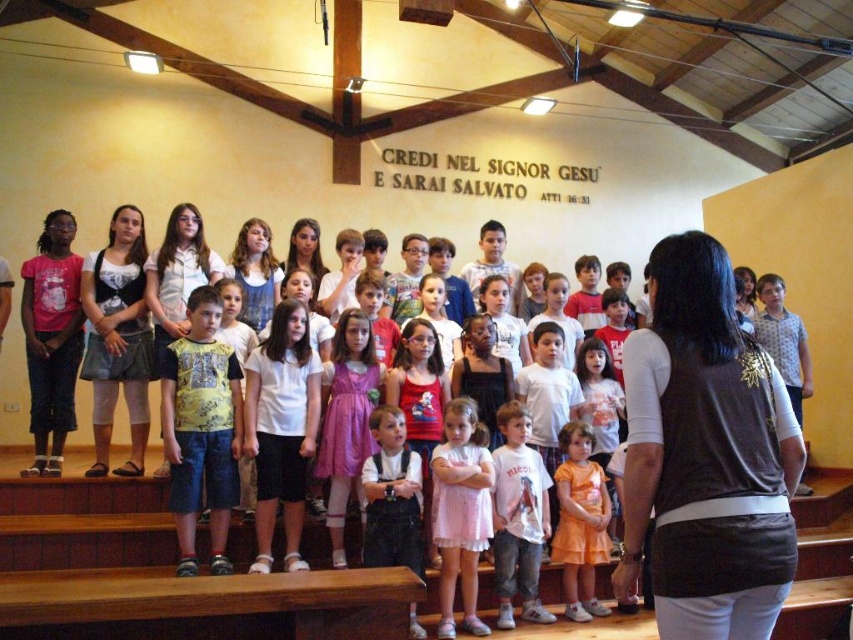
You are a photographer setting up for a school choir performance. You need to ensure that the pink cotton dress at center and the orange satin dress at center are visible in the photo. Which dress should you focus on to capture more detail due to its size?

The orange satin dress at center is thicker than the pink cotton dress at center, so focusing on the orange satin dress at center would allow capturing more detail due to its larger size.